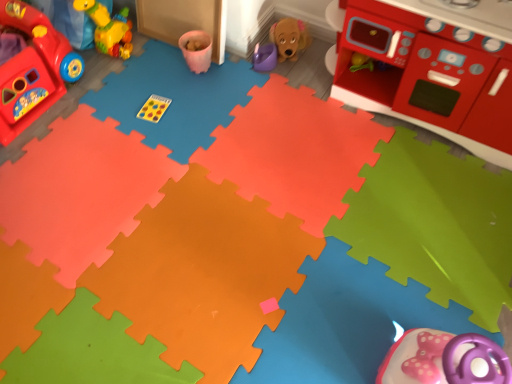
This screenshot has width=512, height=384. Describe the element at coordinates (108, 28) in the screenshot. I see `rubber duck at upper left, which is the second toy in right-to-left order` at that location.

Where is `rubberized red play kitchen at left, the 1th toy viewed from the left`? This screenshot has height=384, width=512. rubberized red play kitchen at left, the 1th toy viewed from the left is located at coordinates (33, 69).

Can you tell me how much smooth plastic toy stove at upper right and purple plastic watering can at center, the first toy viewed from the right, differ in facing direction?

The angular difference between smooth plastic toy stove at upper right and purple plastic watering can at center, the first toy viewed from the right, is 0.00189 degrees.

Is purple plastic watering can at center, which is the third toy in left-to-right order, located within smooth plastic toy stove at upper right?

No, purple plastic watering can at center, which is the third toy in left-to-right order, is not a part of smooth plastic toy stove at upper right.

Which of these two, smooth plastic toy stove at upper right or purple plastic watering can at center, the first toy viewed from the right, stands shorter?

Standing shorter between the two is purple plastic watering can at center, the first toy viewed from the right.

In terms of size, does smooth plastic toy stove at upper right appear bigger or smaller than purple plastic watering can at center, the first toy viewed from the right?

Considering their sizes, smooth plastic toy stove at upper right takes up more space than purple plastic watering can at center, the first toy viewed from the right.

Locate an element on the screen. Image resolution: width=512 pixels, height=384 pixels. the 3rd toy above the smooth plastic toy stove at upper right (from the image's perspective) is located at coordinates (108, 28).

Does smooth plastic toy stove at upper right turn towards rubber duck at upper left, which is counted as the second toy, starting from the left?

No.

From the image's perspective, would you say smooth plastic toy stove at upper right is shown under rubber duck at upper left, which is the second toy in right-to-left order?

Indeed, from the image's perspective, smooth plastic toy stove at upper right is shown beneath rubber duck at upper left, which is the second toy in right-to-left order.

Consider the image. Which point is more forward, (253, 64) or (443, 106)?

The point (443, 106) is closer to the camera.

Is purple plastic watering can at center, the first toy viewed from the right, not near smooth plastic toy stove at upper right?

purple plastic watering can at center, the first toy viewed from the right, is actually quite close to smooth plastic toy stove at upper right.

Is purple plastic watering can at center, which is the third toy in left-to-right order, oriented away from smooth plastic toy stove at upper right?

purple plastic watering can at center, which is the third toy in left-to-right order, is not turned away from smooth plastic toy stove at upper right.

From the image's perspective, is purple plastic watering can at center, which is the third toy in left-to-right order, on top of smooth plastic toy stove at upper right?

Indeed, from the image's perspective, purple plastic watering can at center, which is the third toy in left-to-right order, is shown above smooth plastic toy stove at upper right.

Can you confirm if rubberized red play kitchen at left, the 1th toy viewed from the left, is shorter than smooth plastic toy stove at upper right?

Correct, rubberized red play kitchen at left, the 1th toy viewed from the left, is not as tall as smooth plastic toy stove at upper right.

Does point (34, 47) come closer to viewer compared to point (424, 101)?

That is False.

From the image's perspective, between rubberized red play kitchen at left, the 1th toy viewed from the left, and smooth plastic toy stove at upper right, which one is located above?

rubberized red play kitchen at left, the 1th toy viewed from the left, appears higher in the image.

Is rubberized red play kitchen at left, the 1th toy viewed from the left, wider than smooth plastic toy stove at upper right?

Correct, the width of rubberized red play kitchen at left, the 1th toy viewed from the left, exceeds that of smooth plastic toy stove at upper right.

From a real-world perspective, is rubber duck at upper left, which is the second toy in right-to-left order, below rubberized red play kitchen at left, the 3th toy positioned from the right?

No.

Which object is thinner, rubber duck at upper left, which is counted as the second toy, starting from the left, or rubberized red play kitchen at left, the 3th toy positioned from the right?

rubber duck at upper left, which is counted as the second toy, starting from the left, is thinner.

From the picture: Does rubber duck at upper left, which is the second toy in right-to-left order, have a greater height compared to rubberized red play kitchen at left, the 1th toy viewed from the left?

In fact, rubber duck at upper left, which is the second toy in right-to-left order, may be shorter than rubberized red play kitchen at left, the 1th toy viewed from the left.

Is purple plastic watering can at center, the first toy viewed from the right, wider than rubberized red play kitchen at left, the 1th toy viewed from the left?

No.

Is purple plastic watering can at center, the first toy viewed from the right, oriented towards rubberized red play kitchen at left, the 1th toy viewed from the left?

No, purple plastic watering can at center, the first toy viewed from the right, is not turned towards rubberized red play kitchen at left, the 1th toy viewed from the left.

Is purple plastic watering can at center, which is the third toy in left-to-right order, in front of rubberized red play kitchen at left, the 3th toy positioned from the right?

No, it is not.

Can you confirm if purple plastic watering can at center, which is the third toy in left-to-right order, is smaller than rubberized red play kitchen at left, the 1th toy viewed from the left?

Correct, purple plastic watering can at center, which is the third toy in left-to-right order, occupies less space than rubberized red play kitchen at left, the 1th toy viewed from the left.

Find the location of a particular element. The height and width of the screenshot is (384, 512). toy lying above the purple plastic watering can at center, the first toy viewed from the right (from the image's perspective) is located at coordinates (108, 28).

Based on the photo, is there a large distance between purple plastic watering can at center, which is the third toy in left-to-right order, and rubber duck at upper left, which is the second toy in right-to-left order?

purple plastic watering can at center, which is the third toy in left-to-right order, is near rubber duck at upper left, which is the second toy in right-to-left order, not far away.

Which of these two, purple plastic watering can at center, the first toy viewed from the right, or rubber duck at upper left, which is counted as the second toy, starting from the left, is bigger?

rubber duck at upper left, which is counted as the second toy, starting from the left.

From a real-world perspective, which is physically above, purple plastic watering can at center, the first toy viewed from the right, or rubber duck at upper left, which is the second toy in right-to-left order?

In real-world perspective, rubber duck at upper left, which is the second toy in right-to-left order, is above.

Which toy is the 1st one when counting from the left side of the smooth plastic toy stove at upper right? Please provide its 2D coordinates.

[(264, 57)]

Find the location of a particular element. appliance that appears on the right of rubber duck at upper left, which is the second toy in right-to-left order is located at coordinates (431, 77).

Based on the photo, considering their positions, is rubberized red play kitchen at left, the 1th toy viewed from the left, positioned closer to purple plastic watering can at center, which is the third toy in left-to-right order, than rubber duck at upper left, which is counted as the second toy, starting from the left?

Among the two, rubber duck at upper left, which is counted as the second toy, starting from the left, is located nearer to purple plastic watering can at center, which is the third toy in left-to-right order.

Which object lies nearer to the anchor point rubber duck at upper left, which is counted as the second toy, starting from the left, smooth plastic toy stove at upper right or rubberized red play kitchen at left, the 1th toy viewed from the left?

rubberized red play kitchen at left, the 1th toy viewed from the left, lies closer to rubber duck at upper left, which is counted as the second toy, starting from the left, than the other object.

Which object lies further to the anchor point rubberized red play kitchen at left, the 3th toy positioned from the right, rubber duck at upper left, which is the second toy in right-to-left order, or smooth plastic toy stove at upper right?

smooth plastic toy stove at upper right lies further to rubberized red play kitchen at left, the 3th toy positioned from the right, than the other object.

Which object lies nearer to the anchor point purple plastic watering can at center, the first toy viewed from the right, smooth plastic toy stove at upper right or rubberized red play kitchen at left, the 3th toy positioned from the right?

smooth plastic toy stove at upper right.

Looking at the image, which one is located closer to rubber duck at upper left, which is counted as the second toy, starting from the left, purple plastic watering can at center, which is the third toy in left-to-right order, or rubberized red play kitchen at left, the 1th toy viewed from the left?

rubberized red play kitchen at left, the 1th toy viewed from the left.

Which object lies nearer to the anchor point purple plastic watering can at center, the first toy viewed from the right, smooth plastic toy stove at upper right or rubber duck at upper left, which is counted as the second toy, starting from the left?

smooth plastic toy stove at upper right lies closer to purple plastic watering can at center, the first toy viewed from the right, than the other object.

Looking at the image, which one is located closer to rubberized red play kitchen at left, the 3th toy positioned from the right, smooth plastic toy stove at upper right or rubber duck at upper left, which is the second toy in right-to-left order?

rubber duck at upper left, which is the second toy in right-to-left order, is closer to rubberized red play kitchen at left, the 3th toy positioned from the right.

Which object lies nearer to the anchor point purple plastic watering can at center, which is the third toy in left-to-right order, rubber duck at upper left, which is the second toy in right-to-left order, or rubberized red play kitchen at left, the 3th toy positioned from the right?

The object closer to purple plastic watering can at center, which is the third toy in left-to-right order, is rubber duck at upper left, which is the second toy in right-to-left order.

I want to click on toy between rubber duck at upper left, which is counted as the second toy, starting from the left, and smooth plastic toy stove at upper right, in the horizontal direction, so click(x=264, y=57).

Where is `toy located between rubberized red play kitchen at left, the 1th toy viewed from the left, and purple plastic watering can at center, which is the third toy in left-to-right order, in the left-right direction`? Image resolution: width=512 pixels, height=384 pixels. toy located between rubberized red play kitchen at left, the 1th toy viewed from the left, and purple plastic watering can at center, which is the third toy in left-to-right order, in the left-right direction is located at coordinates (108, 28).